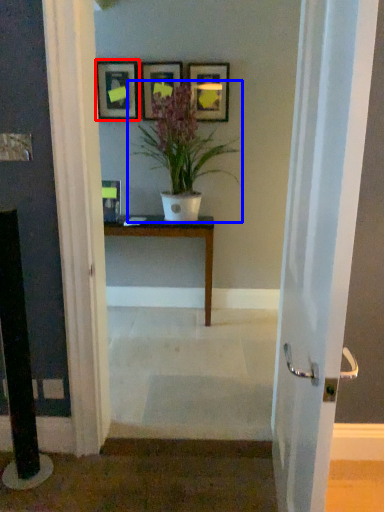
Question: Which point is closer to the camera, picture frame (highlighted by a red box) or houseplant (highlighted by a blue box)?

Choices:
 (A) picture frame
 (B) houseplant

Answer: (B)